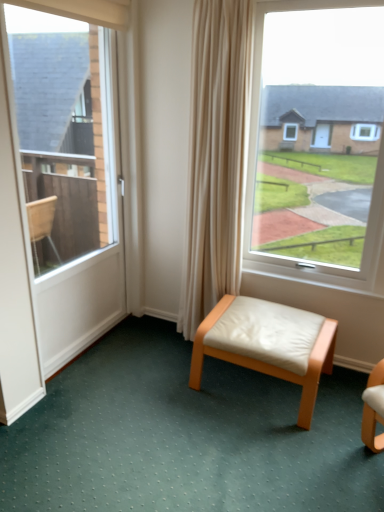
Question: Can you confirm if white leather stool at center is wider than white leather stool at center?

Choices:
 (A) yes
 (B) no

Answer: (A)

Question: Is white leather stool at center positioned before white leather stool at center?

Choices:
 (A) no
 (B) yes

Answer: (B)

Question: Is white leather stool at center thinner than white leather stool at center?

Choices:
 (A) yes
 (B) no

Answer: (B)

Question: Is white leather stool at center facing away from white leather stool at center?

Choices:
 (A) yes
 (B) no

Answer: (B)

Question: Does white leather stool at center turn towards white leather stool at center?

Choices:
 (A) no
 (B) yes

Answer: (A)

Question: Visually, is white leather stool at center positioned to the left or to the right of white leather stool at center?

Choices:
 (A) left
 (B) right

Answer: (B)

Question: Considering the positions of white leather stool at center and white leather stool at center in the image, is white leather stool at center taller or shorter than white leather stool at center?

Choices:
 (A) short
 (B) tall

Answer: (B)

Question: Is point (324, 342) closer or farther from the camera than point (261, 442)?

Choices:
 (A) farther
 (B) closer

Answer: (A)

Question: From the image's perspective, relative to white leather stool at center, is white leather stool at center above or below?

Choices:
 (A) below
 (B) above

Answer: (B)

Question: In terms of size, does white glossy door at left appear bigger or smaller than white leather stool at center?

Choices:
 (A) big
 (B) small

Answer: (B)

Question: From the image's perspective, is white glossy door at left located above or below white leather stool at center?

Choices:
 (A) above
 (B) below

Answer: (A)

Question: From a real-world perspective, is white glossy door at left positioned above or below white leather stool at center?

Choices:
 (A) below
 (B) above

Answer: (B)

Question: Is white glossy door at left spatially inside white leather stool at center, or outside of it?

Choices:
 (A) outside
 (B) inside

Answer: (A)

Question: Is white leather stool at center spatially inside white leather stool at center, or outside of it?

Choices:
 (A) inside
 (B) outside

Answer: (B)

Question: Is white leather stool at center taller or shorter than white leather stool at center?

Choices:
 (A) tall
 (B) short

Answer: (B)